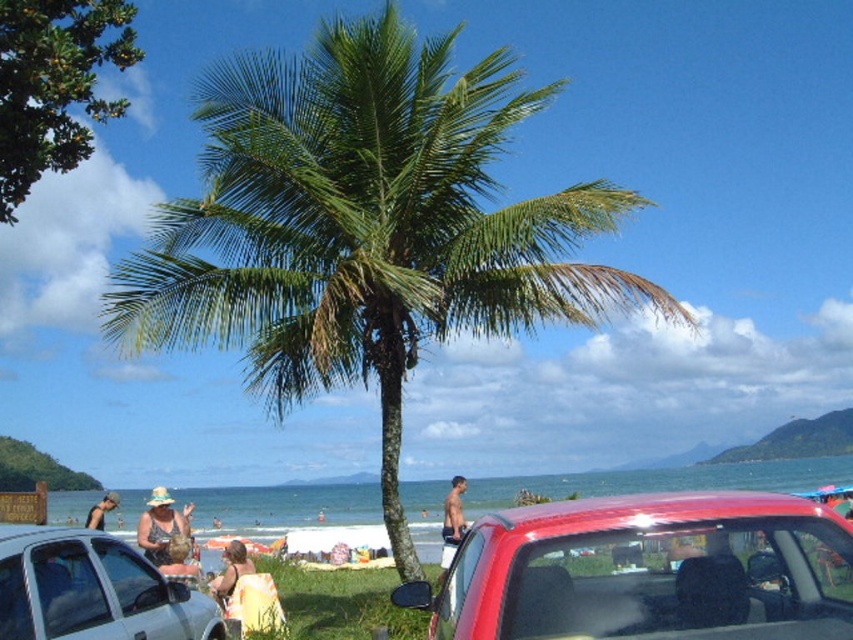
Can you confirm if beige fabric bag at center is thinner than beige fabric dress at lower center?

Yes, beige fabric bag at center is thinner than beige fabric dress at lower center.

Between point (164, 573) and point (109, 509), which one is positioned behind?

The point (109, 509) is more distant.

Between point (193, 568) and point (96, 520), which one is positioned behind?

Point (96, 520)

In order to click on beige fabric bag at center in this screenshot , I will do `click(180, 561)`.

Looking at this image, does green leafy palm tree at center appear under shiny red car at center?

No, green leafy palm tree at center is not below shiny red car at center.

Who is taller, green leafy palm tree at center or shiny red car at center?

green leafy palm tree at center is taller.

Is point (339, 380) closer to viewer compared to point (601, 634)?

No, it is not.

This screenshot has height=640, width=853. Identify the location of green leafy palm tree at center. (364, 227).

Is shiny red car at center positioned before skinny man at center?

Yes.

Can you confirm if shiny red car at center is positioned to the right of skinny man at center?

Yes, shiny red car at center is to the right of skinny man at center.

The image size is (853, 640). In order to click on shiny red car at center in this screenshot , I will do `click(648, 570)`.

Where is `shiny red car at center`? This screenshot has width=853, height=640. shiny red car at center is located at coordinates (648, 570).